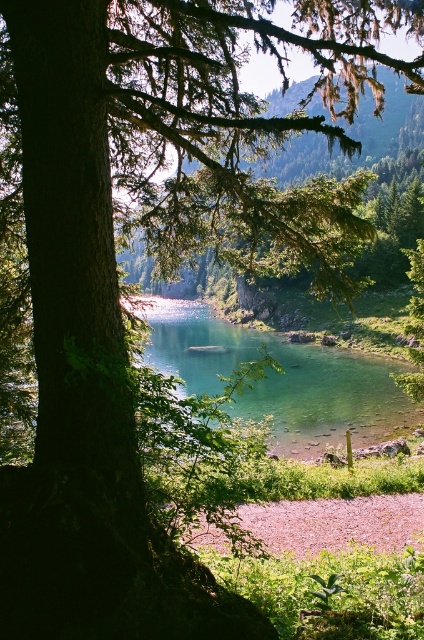
Does clear glass water at center appear over pink gravel shore at lower center?

Correct, clear glass water at center is located above pink gravel shore at lower center.

Does clear glass water at center have a smaller size compared to pink gravel shore at lower center?

No.

This screenshot has width=424, height=640. I want to click on clear glass water at center, so click(281, 378).